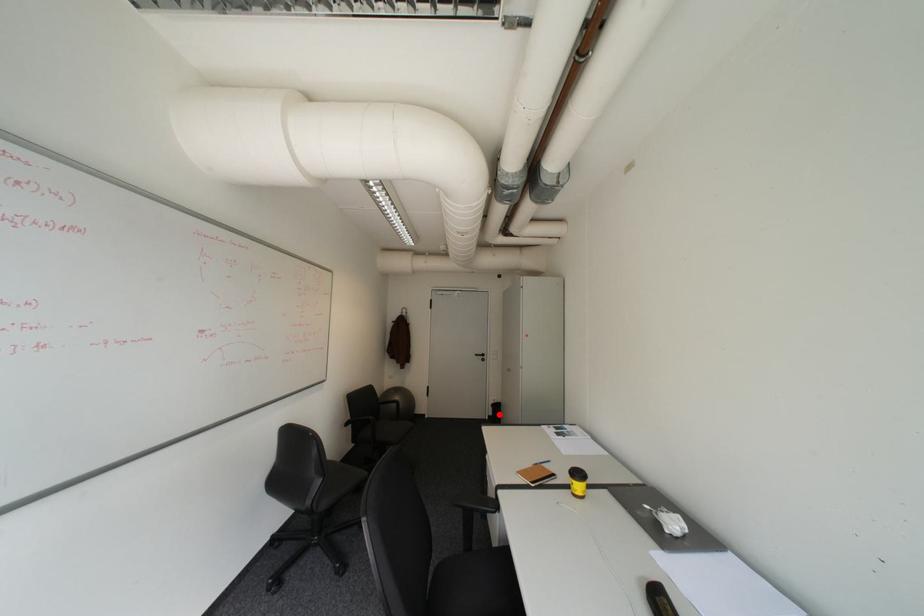
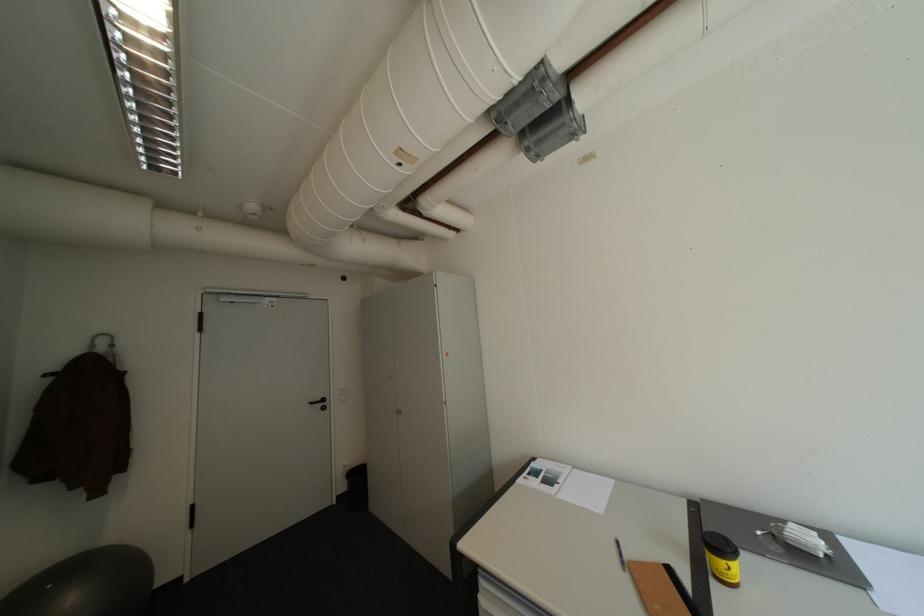
Question: A red point is marked in image1. In image2, is the corresponding 3D point closer to the camera or farther? Reply with the corresponding letter.

Choices:
 (A) The corresponding 3D point is closer.
 (B) The corresponding 3D point is farther.

Answer: (B)